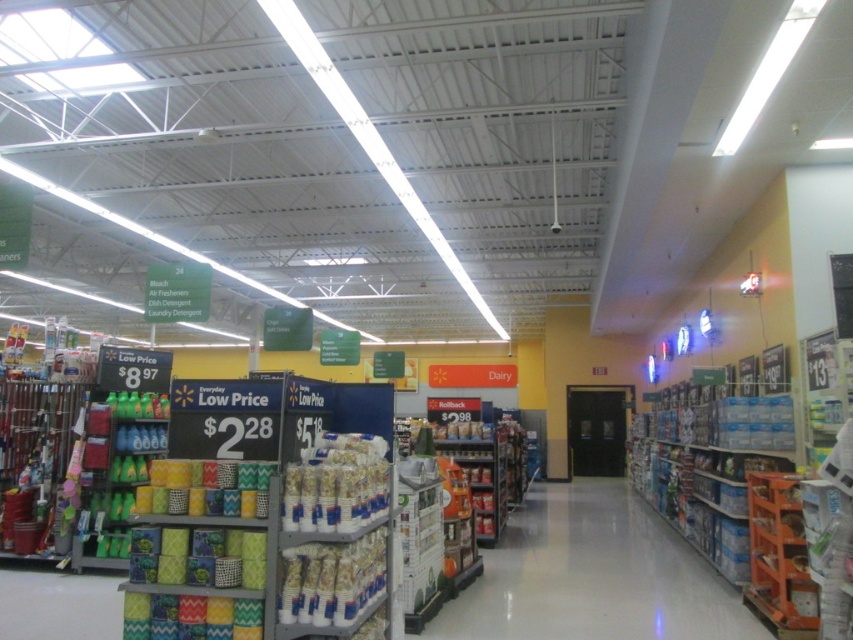
Question: Can you confirm if matte plastic bottles at left is smaller than white paper towels at center?

Choices:
 (A) no
 (B) yes

Answer: (A)

Question: Does matte plastic bottles at left have a smaller size compared to white paper towels at center?

Choices:
 (A) no
 (B) yes

Answer: (A)

Question: Can you confirm if matte plastic bottles at left is smaller than white paper towels at center?

Choices:
 (A) no
 (B) yes

Answer: (A)

Question: Based on their relative distances, which object is farther from the white paper towels at center?

Choices:
 (A) matte plastic bottles at left
 (B) orange cardboard boxes at center

Answer: (A)

Question: Which object appears farthest from the camera in this image?

Choices:
 (A) matte plastic bottles at left
 (B) white paper towels at center
 (C) orange cardboard boxes at center

Answer: (A)

Question: Which object appears closest to the camera in this image?

Choices:
 (A) matte plastic bottles at left
 (B) orange cardboard boxes at center
 (C) white paper towels at center

Answer: (C)